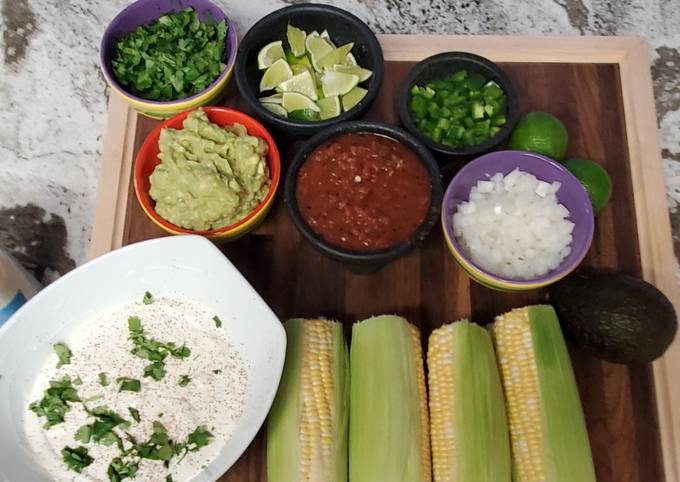
At what (x,y) coordinates should I click in order to perform the action: click on counter. Please return your answer as a coordinate pair (x, y). This screenshot has height=482, width=680. Looking at the image, I should click on (71, 198).